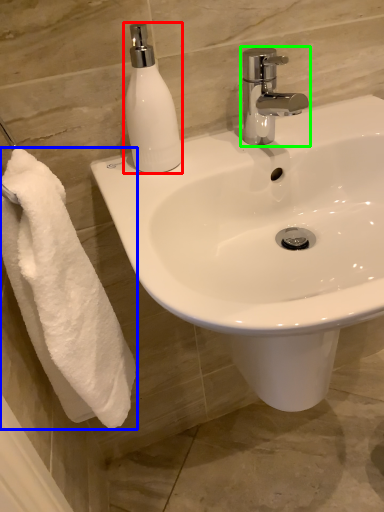
Question: Considering the real-world distances, which object is closest to soap dispenser (highlighted by a red box)? towel (highlighted by a blue box) or tap (highlighted by a green box).

Choices:
 (A) towel
 (B) tap

Answer: (B)